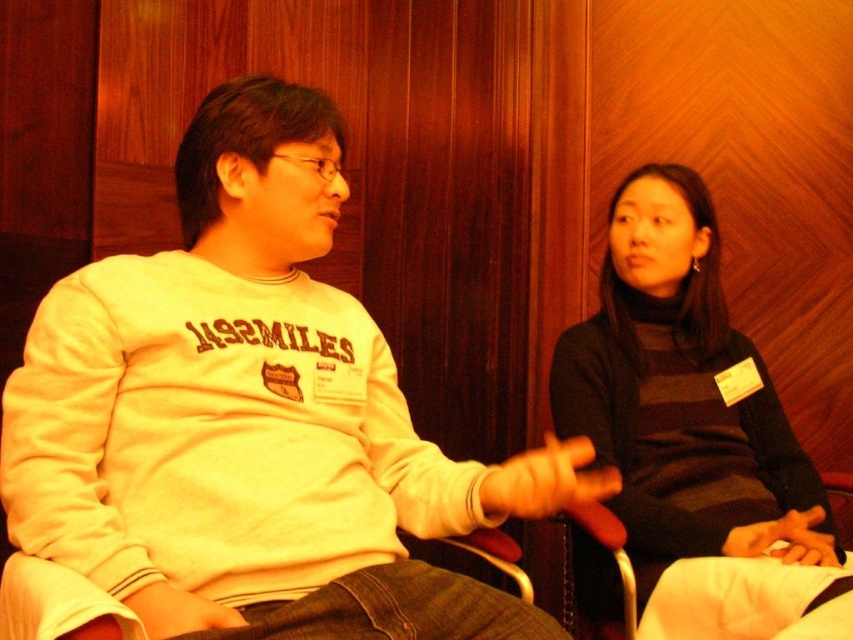
You are a tailor measuring the distance between two clothing items on a rack. The white fleece sweatshirt at center and the dark gray sweater at center are both hanging on the rack. Can you fit a 24 inch wide hanger between them?

The distance between the white fleece sweatshirt at center and the dark gray sweater at center is 23.69 inches. Since the hanger is 24 inches wide, it is slightly too wide to fit between them.

You are a delivery person who needs to hand a package to the person wearing the white fleece sweatshirt at center. The package is 20 inches long. Can you reach them without moving the package?

The white fleece sweatshirt at center and viewer are 35.26 inches apart from each other. Since the package is 20 inches long, you can extend it to reach them as 35.26 inches is greater than 20 inches.

You are trying to decide which top to wear for a casual day out. Both the white fleece sweatshirt at center and the dark gray sweater at center are options. Based on their sizes, which one would you choose if you prefer a looser fit?

The white fleece sweatshirt at center is wider than the dark gray sweater at center, so it would be a better choice for a looser fit.